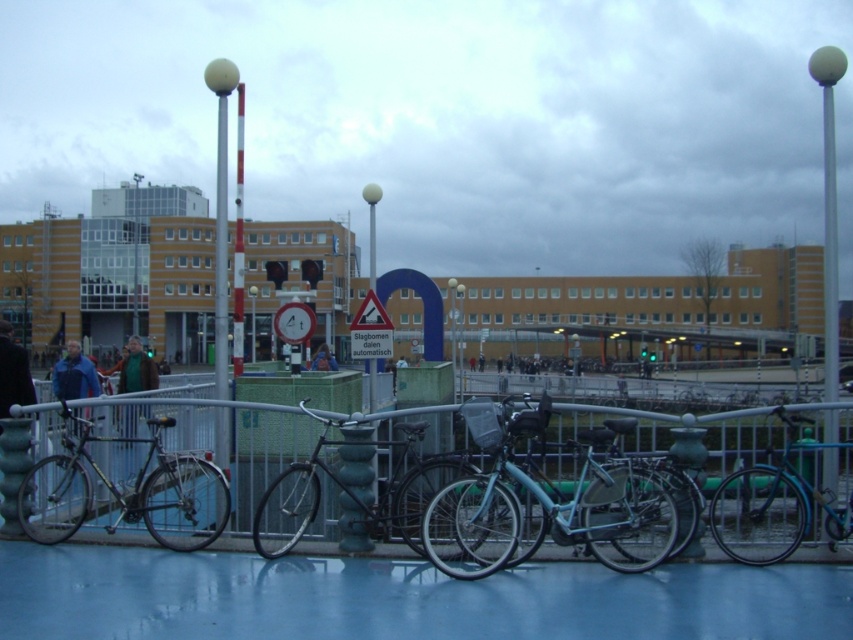
Who is lower down, light blue matte bicycle at center or shiny metallic bicycle at left?

shiny metallic bicycle at left is lower down.

Between light blue matte bicycle at center and shiny metallic bicycle at left, which one is positioned higher?

light blue matte bicycle at center is above.

Identify the location of light blue matte bicycle at center. The image size is (853, 640). (547, 500).

Is metallic triangular sign at center below blue denim jacket at center?

No.

Is point (286, 310) farther from viewer compared to point (332, 356)?

No, (286, 310) is in front of (332, 356).

The width and height of the screenshot is (853, 640). In order to click on metallic triangular sign at center in this screenshot , I will do `click(294, 323)`.

Does green fabric jacket at center appear on the left side of blue matte jacket at left?

Yes, green fabric jacket at center is to the left of blue matte jacket at left.

Can you confirm if green fabric jacket at center is positioned below blue matte jacket at left?

Incorrect, green fabric jacket at center is not positioned below blue matte jacket at left.

The image size is (853, 640). Identify the location of green fabric jacket at center. (135, 369).

The height and width of the screenshot is (640, 853). What are the coordinates of `green fabric jacket at center` in the screenshot? It's located at (135, 369).